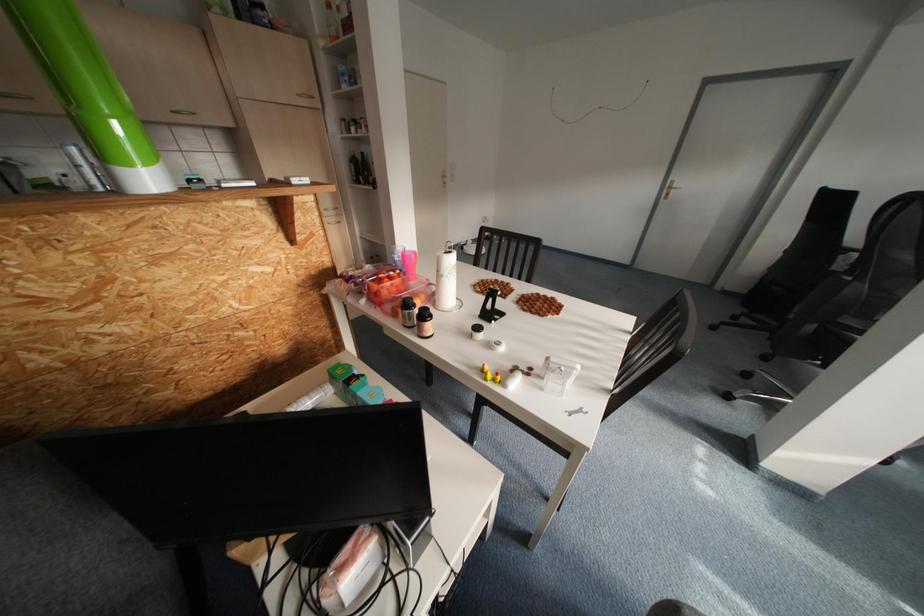
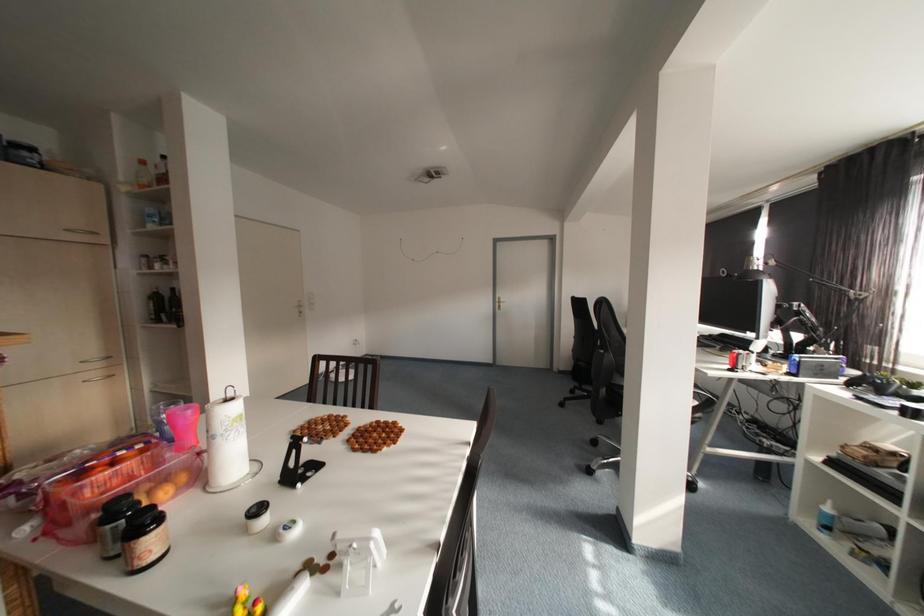
Based on the continuous images, in which direction is the camera rotating?

The rotation direction of the camera is right-up.